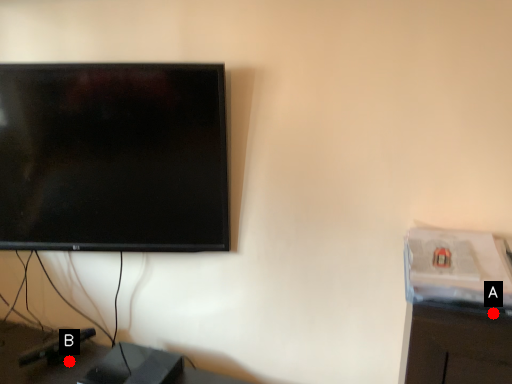
Question: Two points are circled on the image, labeled by A and B beside each circle. Which point appears closest to the camera in this image?

Choices:
 (A) A is closer
 (B) B is closer

Answer: (A)